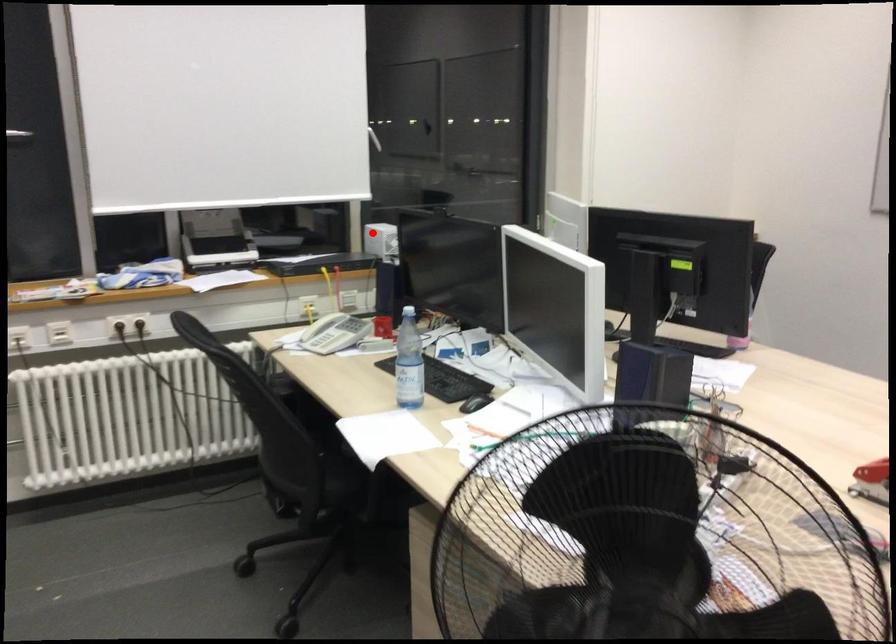
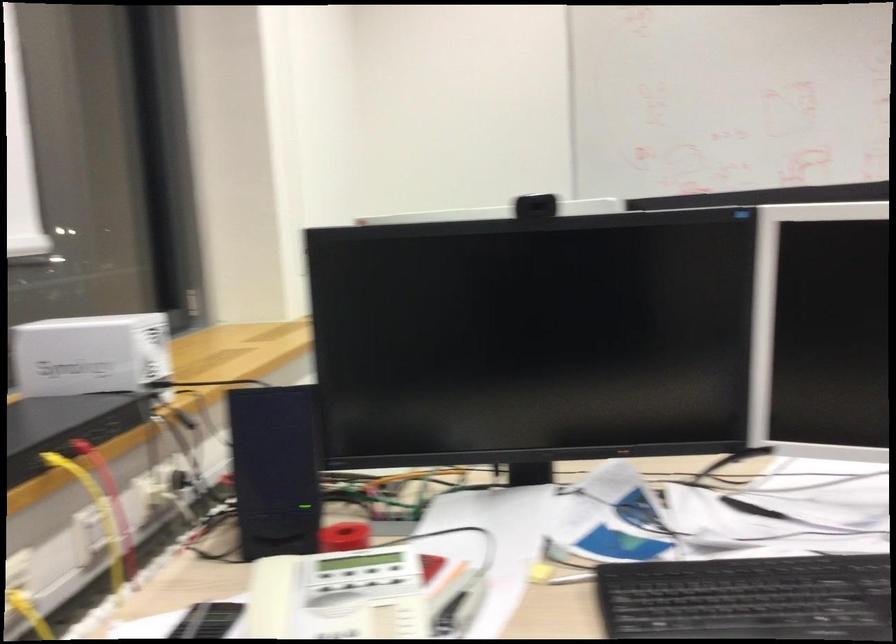
Question: I am providing you with two images of the same scene from different viewpoints. In image1, a red point is highlighted. Considering the same 3D point in image2, which of the following is correct?

Choices:
 (A) It is closer
 (B) It is farther

Answer: (A)